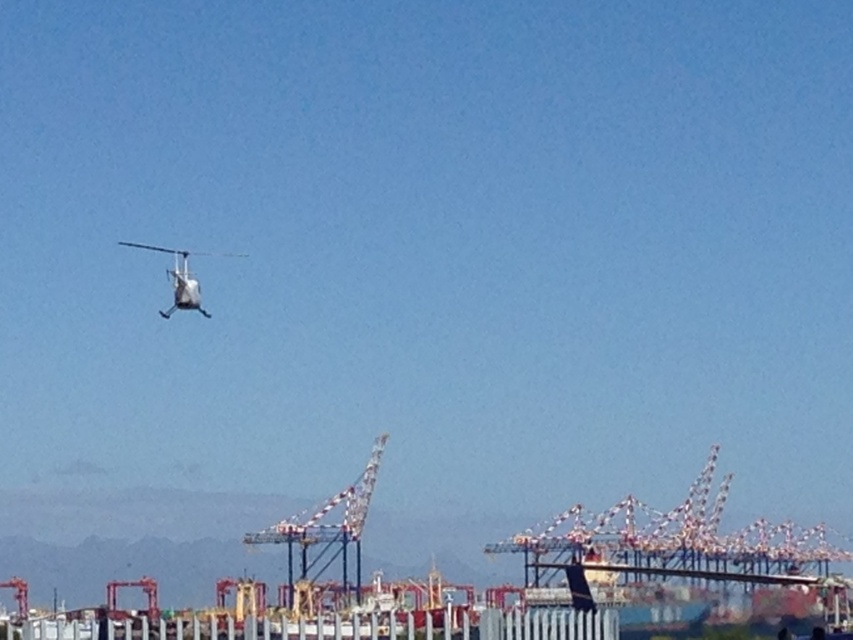
Question: Is the position of white painted metal crane at center more distant than that of white matte helicopter at upper left?

Choices:
 (A) yes
 (B) no

Answer: (B)

Question: Is white painted metal crane at center below white matte helicopter at upper left?

Choices:
 (A) no
 (B) yes

Answer: (B)

Question: Which point is closer to the camera?

Choices:
 (A) (178, 273)
 (B) (358, 557)

Answer: (B)

Question: Can you confirm if white painted metal crane at center is smaller than white matte helicopter at upper left?

Choices:
 (A) no
 (B) yes

Answer: (A)